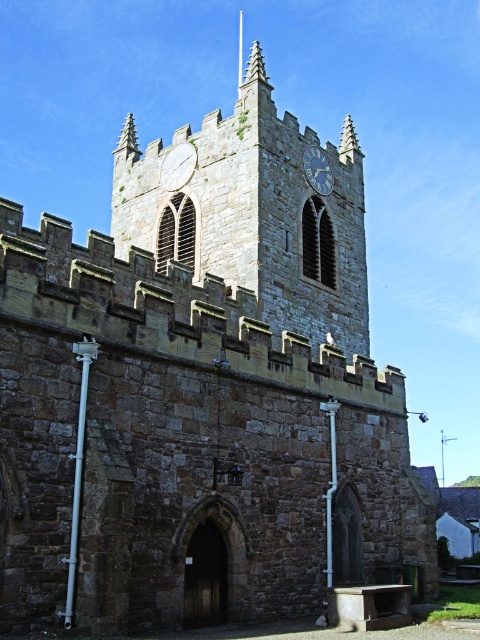
Between stone clock at center and blue stone clock at upper center, which one is positioned higher?

blue stone clock at upper center is higher up.

Where is `stone clock at center`? The width and height of the screenshot is (480, 640). stone clock at center is located at coordinates (178, 166).

Image resolution: width=480 pixels, height=640 pixels. Identify the location of stone clock at center. (178, 166).

Looking at this image, who is more distant from viewer, (273, 276) or (311, 154)?

Positioned behind is point (311, 154).

Between stone clock tower at center and blue stone clock at upper center, which one is positioned lower?

stone clock tower at center

Is point (164, 211) more distant than point (326, 182)?

No, (164, 211) is closer to viewer.

Locate an element on the screen. stone clock tower at center is located at coordinates (255, 212).

Who is shorter, stone clock tower at center or stone clock at center?

stone clock at center

Between stone clock tower at center and stone clock at center, which one has more height?

Standing taller between the two is stone clock tower at center.

You are a GUI agent. You are given a task and a screenshot of the screen. Output one action in this format:
    pyautogui.click(x=<x>, y=<y>)
    Task: Click on the stone clock tower at center
    
    Given the screenshot: What is the action you would take?
    pyautogui.click(x=255, y=212)